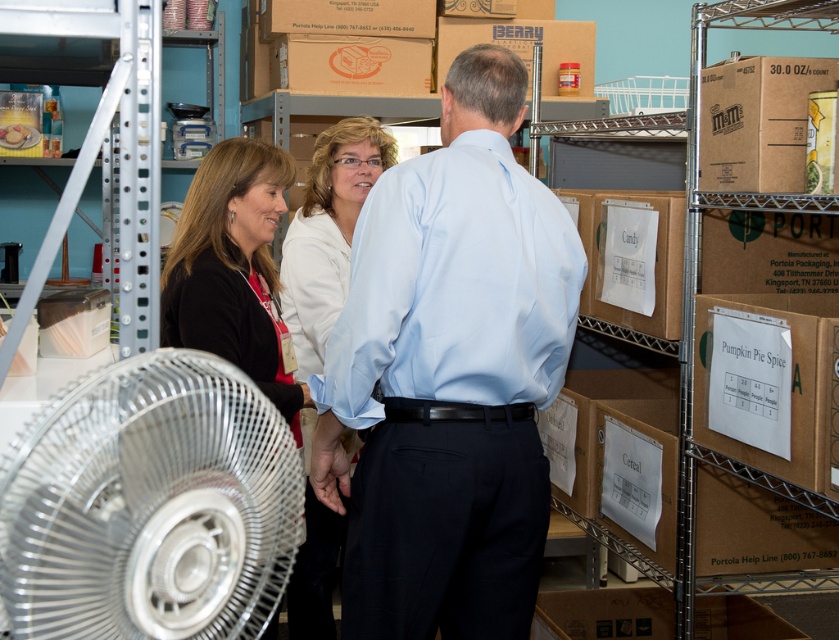
Question: Is white cardboard pumpkin pie spice at right to the right of white matte shirt at center from the viewer's perspective?

Choices:
 (A) yes
 (B) no

Answer: (A)

Question: Can you confirm if light blue shirt at center is positioned below silver metallic fan at lower left?

Choices:
 (A) yes
 (B) no

Answer: (B)

Question: Which object is the closest to the brown cardboard box at lower right?

Choices:
 (A) white cardboard pumpkin pie spice at right
 (B) brown cardboard box at upper right

Answer: (A)

Question: Which object appears closest to the camera in this image?

Choices:
 (A) brown cardboard box at upper right
 (B) white matte shirt at center
 (C) light blue shirt at center
 (D) brown cardboard box at lower right

Answer: (C)

Question: Which point is farther to the camera?

Choices:
 (A) (546, 596)
 (B) (262, 196)
 (C) (592, 44)
 (D) (816, 433)

Answer: (C)

Question: Can you confirm if black fabric jacket at center is bigger than brown cardboard box at lower right?

Choices:
 (A) no
 (B) yes

Answer: (B)